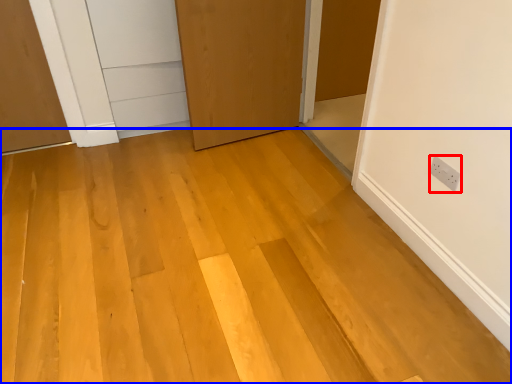
Question: Which object appears farthest to the camera in this image, electric outlet (highlighted by a red box) or plywood (highlighted by a blue box)?

Choices:
 (A) electric outlet
 (B) plywood

Answer: (A)